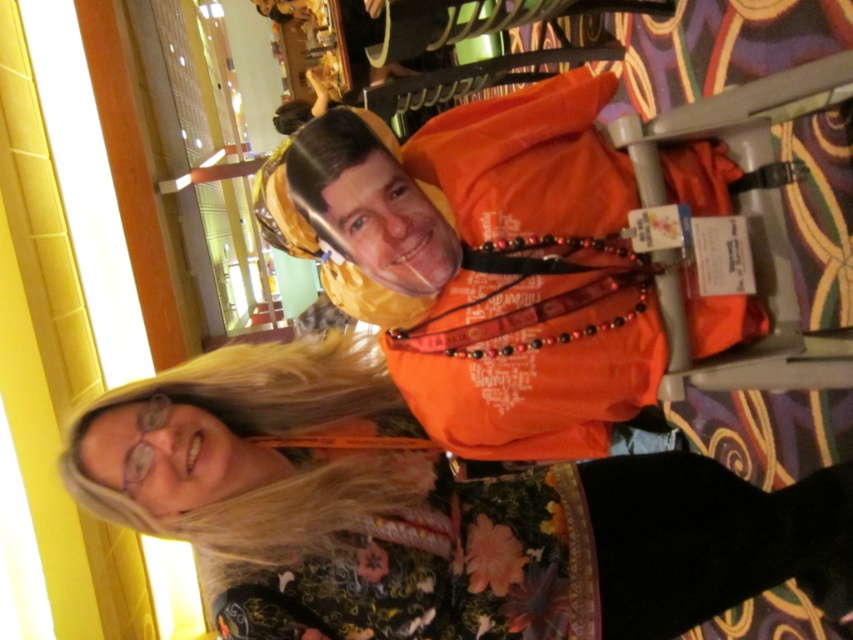
Question: Is floral-patterned dress at center above orange fabric at center?

Choices:
 (A) no
 (B) yes

Answer: (A)

Question: Is floral-patterned dress at center below orange fabric at center?

Choices:
 (A) yes
 (B) no

Answer: (A)

Question: Which of the following is the closest to the observer?

Choices:
 (A) (717, 204)
 (B) (386, 422)

Answer: (A)

Question: From the image, what is the correct spatial relationship of floral-patterned dress at center in relation to orange fabric at center?

Choices:
 (A) below
 (B) above

Answer: (A)

Question: Which object appears farthest from the camera in this image?

Choices:
 (A) floral-patterned dress at center
 (B) orange fabric at center

Answer: (B)